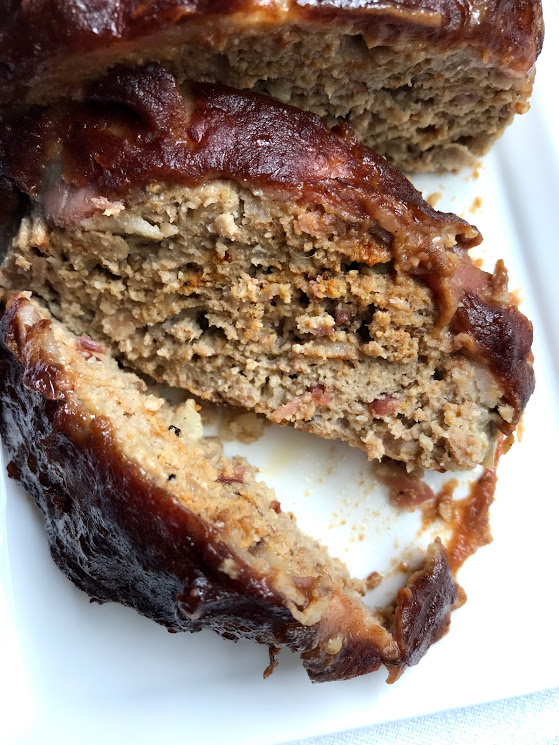
You are a GUI agent. You are given a task and a screenshot of the screen. Output one action in this format:
    pyautogui.click(x=<x>, y=<y>)
    Task: Click on the crumb
    This screenshot has height=745, width=559.
    Given the screenshot: What is the action you would take?
    pyautogui.click(x=476, y=199)